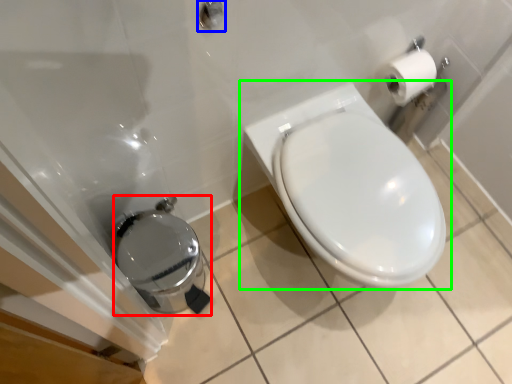
Question: Considering the real-world distances, which object is farthest from porcelain (highlighted by a red box)? shower (highlighted by a blue box) or toilet (highlighted by a green box)?

Choices:
 (A) shower
 (B) toilet

Answer: (A)